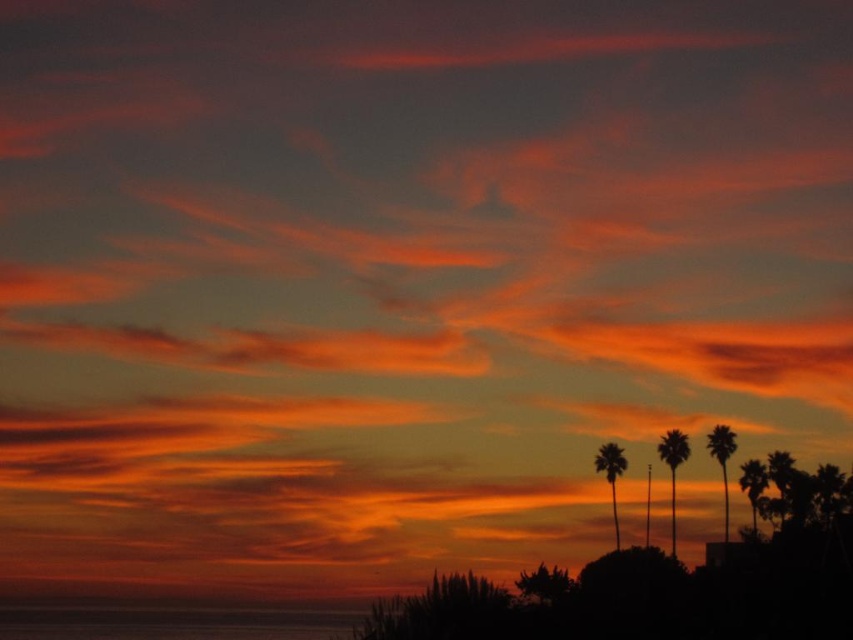
Is point (595, 468) less distant than point (763, 481)?

That is False.

Is silky brown palm tree at center smaller than silky brown palm tree at right?

No, silky brown palm tree at center is not smaller than silky brown palm tree at right.

Between point (595, 456) and point (761, 476), which one is positioned behind?

The point (595, 456) is behind.

You are a GUI agent. You are given a task and a screenshot of the screen. Output one action in this format:
    pyautogui.click(x=<x>, y=<y>)
    Task: Click on the silky brown palm tree at center
    
    Given the screenshot: What is the action you would take?
    pyautogui.click(x=611, y=476)

Locate an element on the screen. The height and width of the screenshot is (640, 853). silhouette palm at right is located at coordinates (672, 470).

Is point (680, 448) closer to camera compared to point (751, 460)?

That is False.

At what (x,y) coordinates should I click in order to perform the action: click on silhouette palm at right. Please return your answer as a coordinate pair (x, y). The height and width of the screenshot is (640, 853). Looking at the image, I should click on (672, 470).

Is the position of smooth water at lower center less distant than that of silky brown palm tree at right?

Yes, it is in front of silky brown palm tree at right.

Is point (100, 628) positioned in front of point (757, 499)?

No, (100, 628) is further to viewer.

Between point (296, 632) and point (750, 506), which one is positioned in front?

Point (750, 506) is in front.

Image resolution: width=853 pixels, height=640 pixels. Find the location of `smooth water at lower center`. smooth water at lower center is located at coordinates pos(173,624).